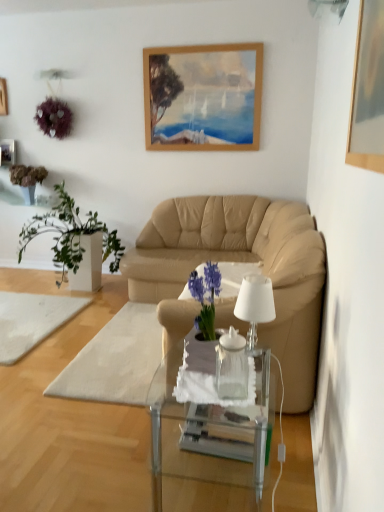
You are a GUI agent. You are given a task and a screenshot of the screen. Output one action in this format:
    pyautogui.click(x=<x>, y=<y>)
    Task: Click on the vacant space to the left of transparent glass coffee table at center
    This screenshot has height=512, width=384.
    Given the screenshot: What is the action you would take?
    pyautogui.click(x=109, y=463)